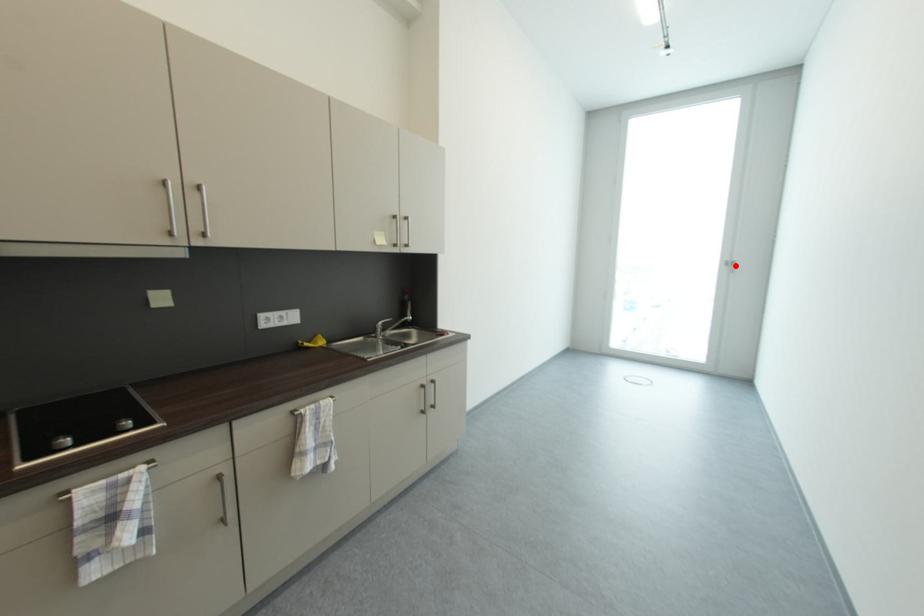
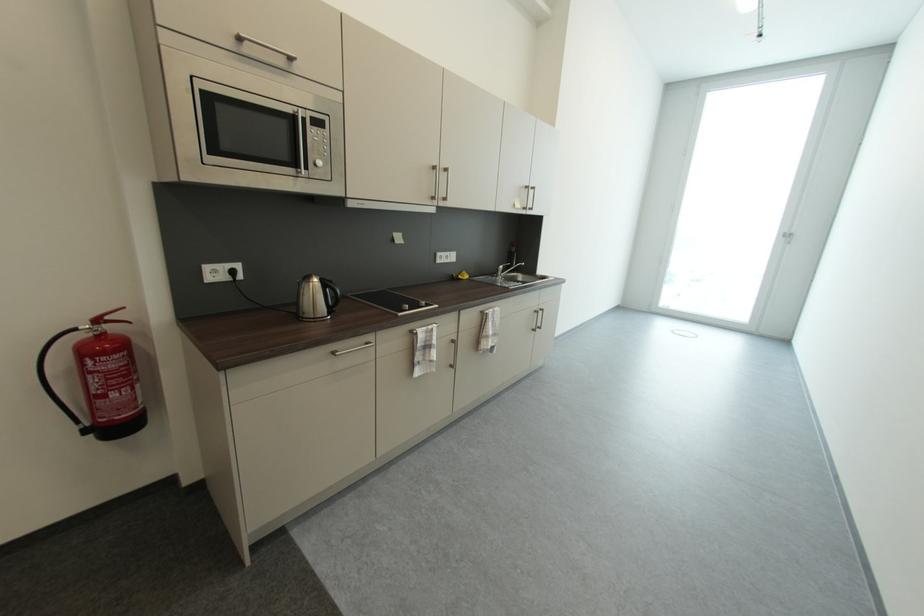
Find the pixel in the second image that matches the highlighted location in the first image.

(794, 238)